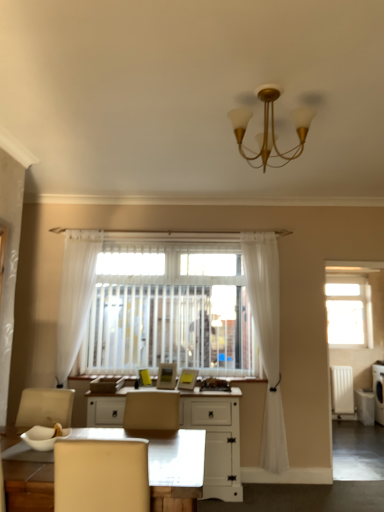
Question: Does white plastic radiator at right have a larger size compared to gold metallic chandelier at upper center?

Choices:
 (A) no
 (B) yes

Answer: (A)

Question: Considering the relative sizes of white plastic radiator at right and gold metallic chandelier at upper center in the image provided, is white plastic radiator at right wider than gold metallic chandelier at upper center?

Choices:
 (A) no
 (B) yes

Answer: (A)

Question: Can you confirm if white plastic radiator at right is thinner than gold metallic chandelier at upper center?

Choices:
 (A) yes
 (B) no

Answer: (A)

Question: Is white plastic radiator at right further to the viewer compared to gold metallic chandelier at upper center?

Choices:
 (A) no
 (B) yes

Answer: (B)

Question: Is white plastic radiator at right oriented towards gold metallic chandelier at upper center?

Choices:
 (A) no
 (B) yes

Answer: (A)

Question: Based on their positions, is white painted wood desk at center located to the left or right of white glossy desk at lower center?

Choices:
 (A) left
 (B) right

Answer: (B)

Question: Is point (200, 418) closer or farther from the camera than point (192, 432)?

Choices:
 (A) closer
 (B) farther

Answer: (B)

Question: Choose the correct answer: Is white painted wood desk at center inside white glossy desk at lower center or outside it?

Choices:
 (A) outside
 (B) inside

Answer: (A)

Question: From the image's perspective, is white painted wood desk at center positioned above or below white glossy desk at lower center?

Choices:
 (A) below
 (B) above

Answer: (A)

Question: Considering the positions of white painted wood desk at center and gold metallic chandelier at upper center in the image, is white painted wood desk at center wider or thinner than gold metallic chandelier at upper center?

Choices:
 (A) wide
 (B) thin

Answer: (A)

Question: Considering the positions of point (233, 437) and point (286, 161), is point (233, 437) closer or farther from the camera than point (286, 161)?

Choices:
 (A) closer
 (B) farther

Answer: (B)

Question: From a real-world perspective, is white painted wood desk at center positioned above or below gold metallic chandelier at upper center?

Choices:
 (A) above
 (B) below

Answer: (B)

Question: Choose the correct answer: Is white painted wood desk at center inside gold metallic chandelier at upper center or outside it?

Choices:
 (A) inside
 (B) outside

Answer: (B)

Question: Considering the positions of white sheer curtain at center, which ranks as the second curtain in left-to-right order, and transparent glass window at upper right in the image, is white sheer curtain at center, which ranks as the second curtain in left-to-right order, bigger or smaller than transparent glass window at upper right?

Choices:
 (A) big
 (B) small

Answer: (A)

Question: From a real-world perspective, is white sheer curtain at center, the first curtain when ordered from right to left, positioned above or below transparent glass window at upper right?

Choices:
 (A) above
 (B) below

Answer: (B)